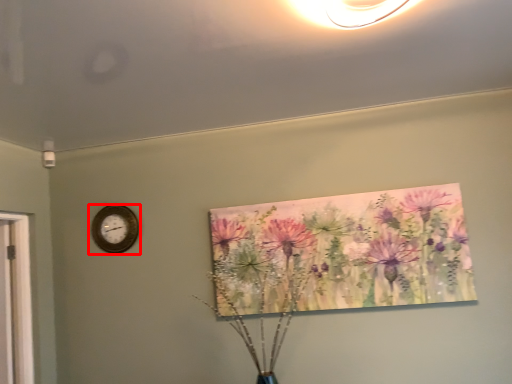
Question: From the image's perspective, what is the correct spatial relationship of wall clock (annotated by the red box) in relation to floral arrangement?

Choices:
 (A) above
 (B) below

Answer: (A)